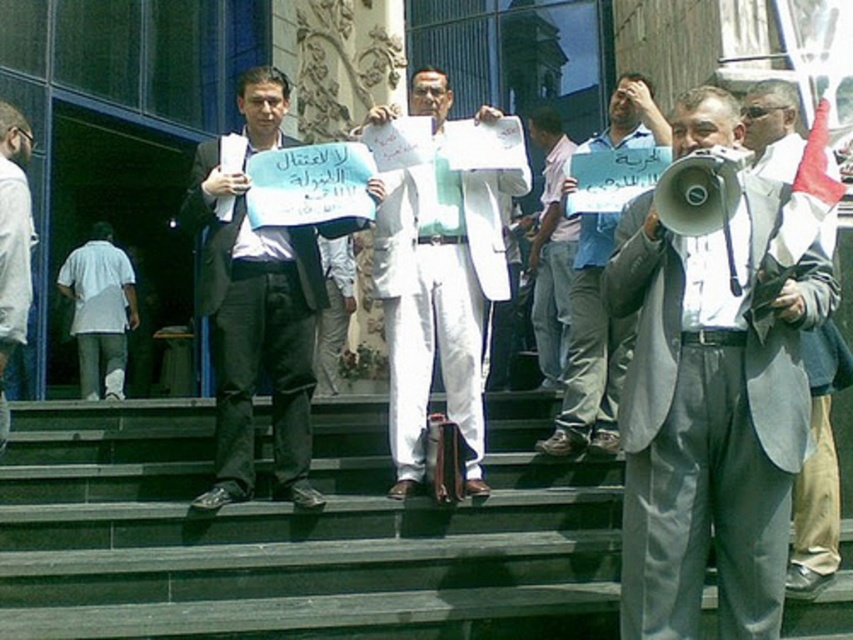
Question: Can you confirm if gray suit at center is bigger than white glossy suit at center?

Choices:
 (A) yes
 (B) no

Answer: (B)

Question: Is matte black suit at center bigger than white shirt at left?

Choices:
 (A) no
 (B) yes

Answer: (B)

Question: Which of the following is the closest to the observer?

Choices:
 (A) white cotton shirt at center
 (B) matte black suit at center

Answer: (B)

Question: Which object is closer to the camera taking this photo?

Choices:
 (A) gray suit at center
 (B) white cotton shirt at left

Answer: (A)

Question: Estimate the real-world distances between objects in this image. Which object is closer to the white cotton shirt at center?

Choices:
 (A) gray suit at center
 (B) white glossy suit at center
 (C) matte black suit at center
 (D) white cotton shirt at left

Answer: (B)

Question: Is white paper sign at center smaller than white cotton shirt at left?

Choices:
 (A) yes
 (B) no

Answer: (B)